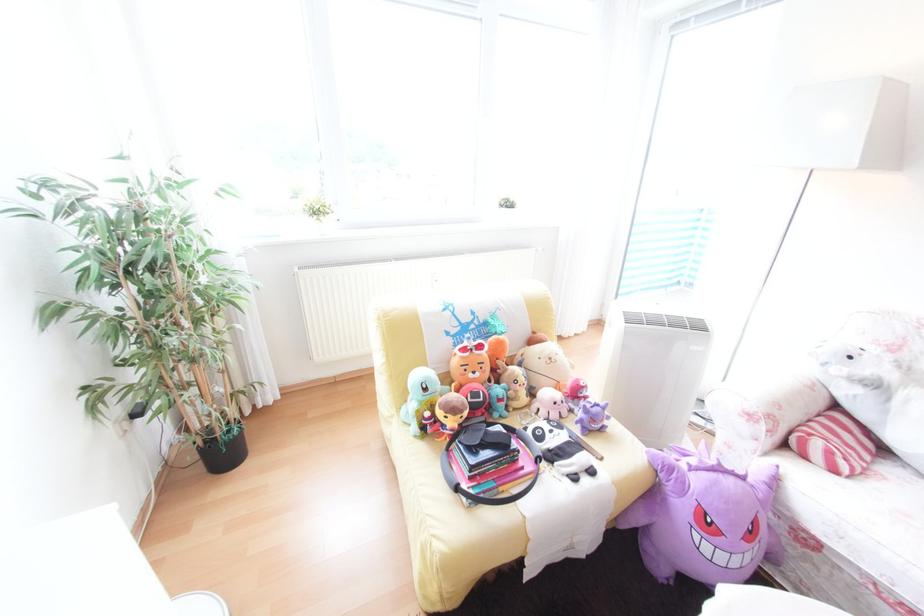
The width and height of the screenshot is (924, 616). I want to click on purple Gengar plush, so click(x=703, y=517).